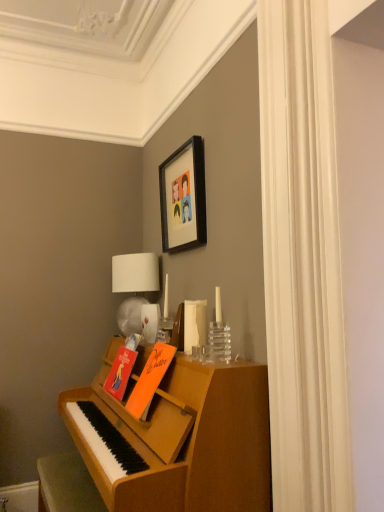
Question: From a real-world perspective, is white fabric lampshade at upper center positioned above or below orange matte book at center, the second book positioned from the back?

Choices:
 (A) above
 (B) below

Answer: (A)

Question: From the image's perspective, relative to orange matte book at center, the second book positioned from the back, is white fabric lampshade at upper center above or below?

Choices:
 (A) below
 (B) above

Answer: (B)

Question: Estimate the real-world distances between objects in this image. Which object is farther from the black matte picture frame at upper center?

Choices:
 (A) wooden piano at lower left
 (B) white fabric lampshade at upper center
 (C) orange matte book at center, the second book positioned from the back
 (D) orange matte book at center, arranged as the first book when viewed from the back

Answer: (A)

Question: Estimate the real-world distances between objects in this image. Which object is closer to the black matte picture frame at upper center?

Choices:
 (A) orange matte book at center, arranged as the first book when viewed from the back
 (B) wooden piano at lower left
 (C) orange matte book at center, which is counted as the 1th book, starting from the front
 (D) white fabric lampshade at upper center

Answer: (D)